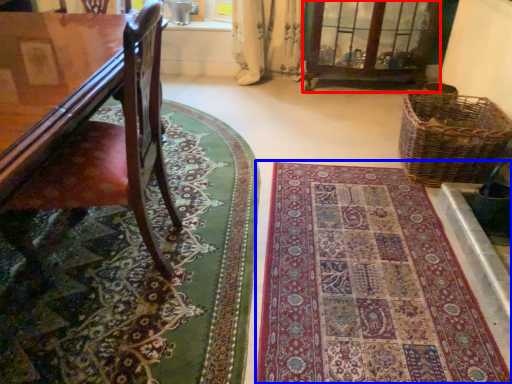
Question: Among these objects, which one is nearest to the camera, bay window (highlighted by a red box) or mat (highlighted by a blue box)?

Choices:
 (A) bay window
 (B) mat

Answer: (B)